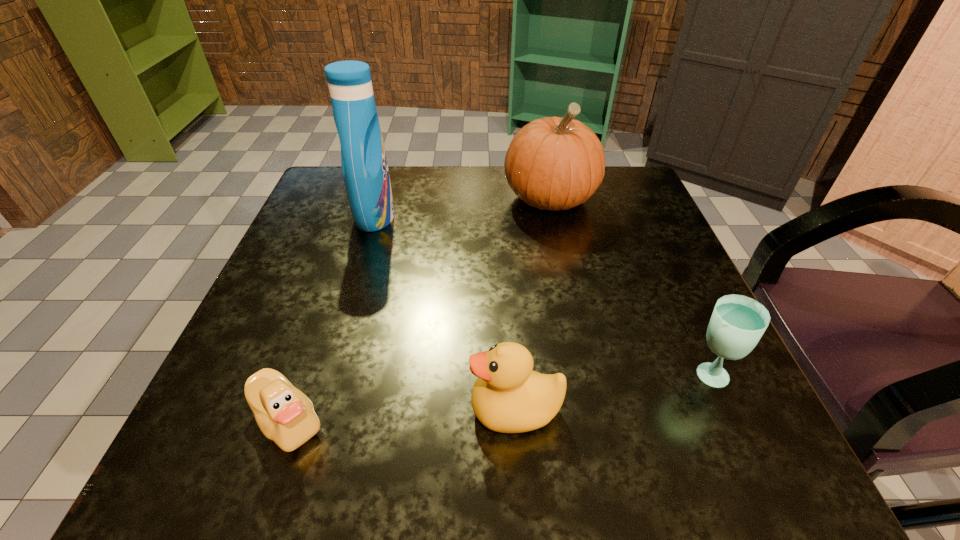
Where is `the tallest object`? The height and width of the screenshot is (540, 960). the tallest object is located at coordinates (365, 171).

You are a GUI agent. You are given a task and a screenshot of the screen. Output one action in this format:
    pyautogui.click(x=<x>, y=<y>)
    Task: Click on the second tallest object
    
    Given the screenshot: What is the action you would take?
    pyautogui.click(x=554, y=163)

Locate an element on the screen. This screenshot has height=540, width=960. the rightmost object is located at coordinates (738, 322).

You are a GUI agent. You are given a task and a screenshot of the screen. Output one action in this format:
    pyautogui.click(x=<x>, y=<y>)
    Task: Click on the right duck
    This screenshot has height=540, width=960.
    Given the screenshot: What is the action you would take?
    pyautogui.click(x=508, y=397)

This screenshot has height=540, width=960. I want to click on the left duck, so click(x=285, y=415).

Where is `the shorter duck`? The image size is (960, 540). the shorter duck is located at coordinates (285, 415).

Where is `blank area located on the front-facing side of the tallest object`? blank area located on the front-facing side of the tallest object is located at coordinates (480, 215).

I want to click on free region located 0.210m on the stem of the second tallest object, so click(x=571, y=301).

Identify the location of free space located on the left of the glass. point(547,374).

I want to click on free space located 0.130m at the beak of the right duck, so click(374, 409).